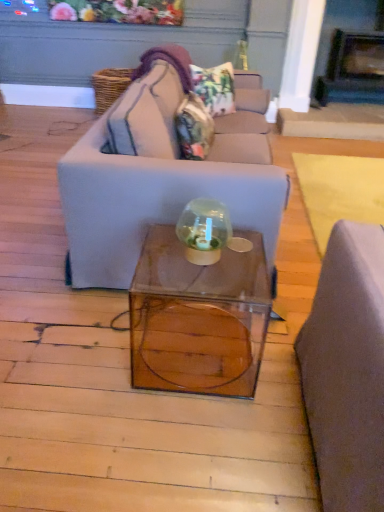
Measure the distance between point [200,326] and camera.

Point [200,326] and camera are 6.27 feet apart.

Describe the element at coordinates (215, 87) in the screenshot. The width and height of the screenshot is (384, 512). I see `floral fabric pillow at upper center, the first pillow positioned from the top` at that location.

Describe the element at coordinates (194, 128) in the screenshot. This screenshot has width=384, height=512. I see `camouflage fabric pillow at center, the 1th pillow positioned from the bottom` at that location.

Identify the location of camouflage fabric pillow at center, the 1th pillow positioned from the bottom. This screenshot has height=512, width=384. (194, 128).

Image resolution: width=384 pixels, height=512 pixels. I want to click on transparent glass globe at center, so click(x=204, y=230).

Considering their positions, is camouflage fabric pillow at center, which is counted as the second pillow, starting from the top, located in front of or behind transparent glass cube at center?

Clearly, camouflage fabric pillow at center, which is counted as the second pillow, starting from the top, is behind transparent glass cube at center.

Is camouflage fabric pillow at center, the 1th pillow positioned from the bottom, not within transparent glass cube at center?

Indeed, camouflage fabric pillow at center, the 1th pillow positioned from the bottom, is completely outside transparent glass cube at center.

Considering the positions of objects camouflage fabric pillow at center, which is counted as the second pillow, starting from the top, and transparent glass cube at center in the image provided, who is more to the right, camouflage fabric pillow at center, which is counted as the second pillow, starting from the top, or transparent glass cube at center?

From the viewer's perspective, transparent glass cube at center appears more on the right side.

How far apart are camouflage fabric pillow at center, which is counted as the second pillow, starting from the top, and transparent glass cube at center?

They are 1.08 meters apart.

Could you tell me if dark gray stone fireplace at upper right is facing transparent glass globe at center?

Yes.

Looking at this image, from the image's perspective, which one is positioned lower, dark gray stone fireplace at upper right or transparent glass globe at center?

transparent glass globe at center is shown below in the image.

In the scene shown: Does dark gray stone fireplace at upper right appear on the left side of transparent glass globe at center?

In fact, dark gray stone fireplace at upper right is to the right of transparent glass globe at center.

Is the position of dark gray stone fireplace at upper right more distant than that of transparent glass globe at center?

That is True.

Choose the correct answer: Is transparent glass globe at center inside floral fabric pillow at upper center, the first pillow positioned from the top, or outside it?

The correct answer is: outside.

In the scene shown: In terms of width, does transparent glass globe at center look wider or thinner when compared to floral fabric pillow at upper center, the first pillow positioned from the top?

In the image, transparent glass globe at center appears to be more narrow than floral fabric pillow at upper center, the first pillow positioned from the top.

Between transparent glass globe at center and floral fabric pillow at upper center, which ranks as the 2th pillow in bottom-to-top order, which one has smaller size?

With smaller size is transparent glass globe at center.

Which of these two, camouflage fabric pillow at center, which is counted as the second pillow, starting from the top, or dark gray stone fireplace at upper right, stands taller?

With more height is dark gray stone fireplace at upper right.

Considering the relative positions of camouflage fabric pillow at center, which is counted as the second pillow, starting from the top, and dark gray stone fireplace at upper right in the image provided, is camouflage fabric pillow at center, which is counted as the second pillow, starting from the top, to the left or to the right of dark gray stone fireplace at upper right?

camouflage fabric pillow at center, which is counted as the second pillow, starting from the top, is to the left of dark gray stone fireplace at upper right.

Is dark gray stone fireplace at upper right inside camouflage fabric pillow at center, the 1th pillow positioned from the bottom?

No, dark gray stone fireplace at upper right is not a part of camouflage fabric pillow at center, the 1th pillow positioned from the bottom.

Who is smaller, camouflage fabric pillow at center, which is counted as the second pillow, starting from the top, or dark gray stone fireplace at upper right?

camouflage fabric pillow at center, which is counted as the second pillow, starting from the top, is smaller.

Which is nearer, (366, 101) or (223, 108)?

Point (366, 101) appears to be farther away from the viewer than point (223, 108).

From the image's perspective, between dark gray stone fireplace at upper right and floral fabric pillow at upper center, which ranks as the 2th pillow in bottom-to-top order, who is located below?

From the image's view, floral fabric pillow at upper center, which ranks as the 2th pillow in bottom-to-top order, is below.

Could you measure the distance between dark gray stone fireplace at upper right and floral fabric pillow at upper center, which ranks as the 2th pillow in bottom-to-top order?

dark gray stone fireplace at upper right is 2.06 meters from floral fabric pillow at upper center, which ranks as the 2th pillow in bottom-to-top order.

Considering the sizes of dark gray stone fireplace at upper right and matte gray couch at center in the image, is dark gray stone fireplace at upper right taller or shorter than matte gray couch at center?

In the image, dark gray stone fireplace at upper right appears to be taller than matte gray couch at center.

From the image's perspective, would you say dark gray stone fireplace at upper right is shown under matte gray couch at center?

Actually, dark gray stone fireplace at upper right appears above matte gray couch at center in the image.

Looking at this image, from a real-world perspective, does dark gray stone fireplace at upper right stand above matte gray couch at center?

Yes.

How far apart are dark gray stone fireplace at upper right and matte gray couch at center?

They are 3.13 meters apart.

From the image's perspective, does transparent glass globe at center appear higher than dark gray stone fireplace at upper right?

No, from the image's perspective, transparent glass globe at center is not above dark gray stone fireplace at upper right.

Between transparent glass globe at center and dark gray stone fireplace at upper right, which one has smaller size?

Smaller between the two is transparent glass globe at center.

From the picture: From a real-world perspective, which object rests below the other?

transparent glass globe at center is physically lower.

The width and height of the screenshot is (384, 512). Find the location of `pillow that is the 1st one when counting backward from the transparent glass cube at center`. pillow that is the 1st one when counting backward from the transparent glass cube at center is located at coordinates (194, 128).

The width and height of the screenshot is (384, 512). I want to click on glass jar on the left side of dark gray stone fireplace at upper right, so click(x=204, y=230).

Considering their positions, is dark gray stone fireplace at upper right positioned further to transparent glass cube at center than transparent glass globe at center?

The object further to transparent glass cube at center is dark gray stone fireplace at upper right.

Estimate the real-world distances between objects in this image. Which object is further from dark gray stone fireplace at upper right, transparent glass cube at center or matte gray couch at center?

transparent glass cube at center is further to dark gray stone fireplace at upper right.

Which object lies further to the anchor point floral fabric pillow at upper center, the first pillow positioned from the top, transparent glass globe at center or matte gray couch at center?

The object further to floral fabric pillow at upper center, the first pillow positioned from the top, is transparent glass globe at center.

Which object lies nearer to the anchor point dark gray stone fireplace at upper right, floral fabric pillow at upper center, which ranks as the 2th pillow in bottom-to-top order, or transparent glass cube at center?

floral fabric pillow at upper center, which ranks as the 2th pillow in bottom-to-top order, is positioned closer to the anchor dark gray stone fireplace at upper right.

Considering their positions, is dark gray stone fireplace at upper right positioned closer to camouflage fabric pillow at center, which is counted as the second pillow, starting from the top, than transparent glass cube at center?

transparent glass cube at center.

Which object lies nearer to the anchor point transparent glass globe at center, matte gray couch at center or camouflage fabric pillow at center, which is counted as the second pillow, starting from the top?

The object closer to transparent glass globe at center is matte gray couch at center.

Which object lies further to the anchor point matte gray couch at center, floral fabric pillow at upper center, which ranks as the 2th pillow in bottom-to-top order, or dark gray stone fireplace at upper right?

dark gray stone fireplace at upper right lies further to matte gray couch at center than the other object.

Looking at the image, which one is located closer to dark gray stone fireplace at upper right, transparent glass cube at center or camouflage fabric pillow at center, which is counted as the second pillow, starting from the top?

camouflage fabric pillow at center, which is counted as the second pillow, starting from the top, lies closer to dark gray stone fireplace at upper right than the other object.

Where is `studio couch between transparent glass cube at center and floral fabric pillow at upper center, which ranks as the 2th pillow in bottom-to-top order, from front to back`? Image resolution: width=384 pixels, height=512 pixels. studio couch between transparent glass cube at center and floral fabric pillow at upper center, which ranks as the 2th pillow in bottom-to-top order, from front to back is located at coordinates (161, 175).

The width and height of the screenshot is (384, 512). In order to click on pillow between transparent glass cube at center and floral fabric pillow at upper center, which ranks as the 2th pillow in bottom-to-top order, from front to back in this screenshot , I will do `click(194, 128)`.

I want to click on studio couch that lies between camouflage fabric pillow at center, the 1th pillow positioned from the bottom, and transparent glass cube at center from top to bottom, so click(x=161, y=175).

Locate an element on the screen. studio couch between transparent glass globe at center and dark gray stone fireplace at upper right in the front-back direction is located at coordinates (161, 175).